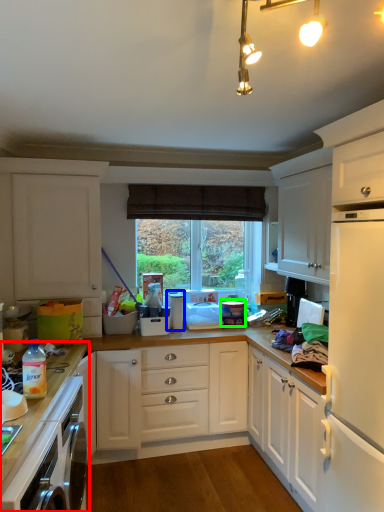
Question: Which is farther away from countertop (highlighted by a red box)? appliance (highlighted by a blue box) or appliance (highlighted by a green box)?

Choices:
 (A) appliance
 (B) appliance

Answer: (B)